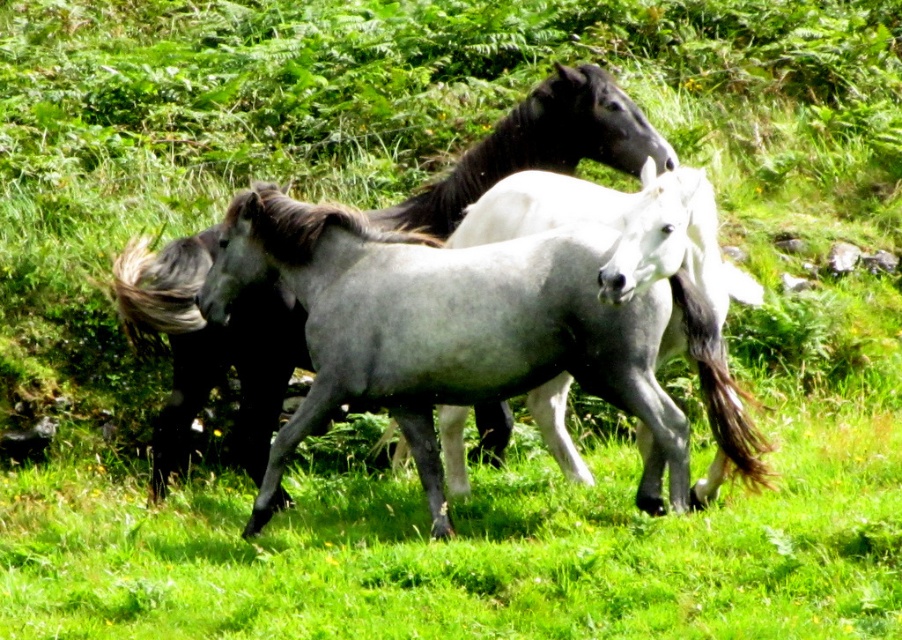
Question: Does gray glossy horse at center appear over white glossy horse at center?

Choices:
 (A) no
 (B) yes

Answer: (A)

Question: Among these points, which one is farthest from the camera?

Choices:
 (A) (711, 212)
 (B) (595, 83)

Answer: (B)

Question: From the image, what is the correct spatial relationship of gray glossy horse at center in relation to white glossy horse at center?

Choices:
 (A) below
 (B) above

Answer: (A)

Question: Can you confirm if gray glossy horse at center is positioned below white glossy horse at center?

Choices:
 (A) yes
 (B) no

Answer: (A)

Question: Which point is farther to the camera?

Choices:
 (A) gray glossy horse at center
 (B) white glossy horse at center

Answer: (A)

Question: Which point is farther to the camera?

Choices:
 (A) (253, 317)
 (B) (726, 433)

Answer: (A)